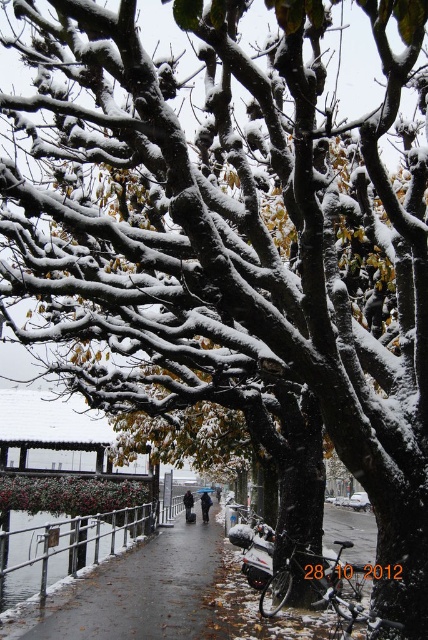
You are standing on the pathway in the winter scene and want to take a photo of both the tree and the water. You notice two points marked on your camera screen at coordinates point (208, 499) and point (189, 512). Which point should you focus on to ensure both the tree and the water are in focus?

You should focus on point (208, 499) because it is closer to the camera than point (189, 512). By focusing on the closer point, the depth of field will cover both the tree and the water in the background.